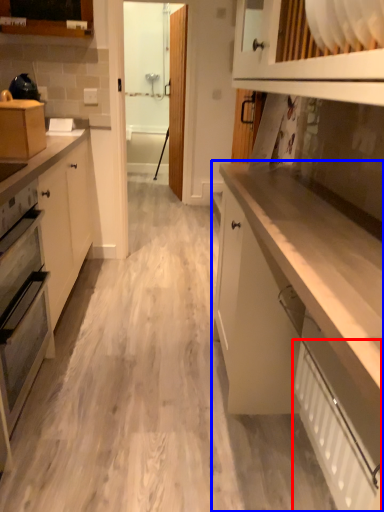
Question: Which object appears closest to the camera in this image, radiator (highlighted by a red box) or cabinetry (highlighted by a blue box)?

Choices:
 (A) radiator
 (B) cabinetry

Answer: (B)